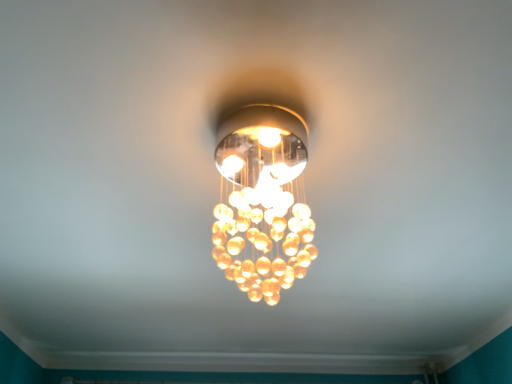
What do you see at coordinates (263, 197) in the screenshot? I see `translucent glass chandelier at center` at bounding box center [263, 197].

The image size is (512, 384). I want to click on translucent glass chandelier at center, so click(x=263, y=197).

The height and width of the screenshot is (384, 512). I want to click on translucent glass chandelier at center, so click(x=263, y=197).